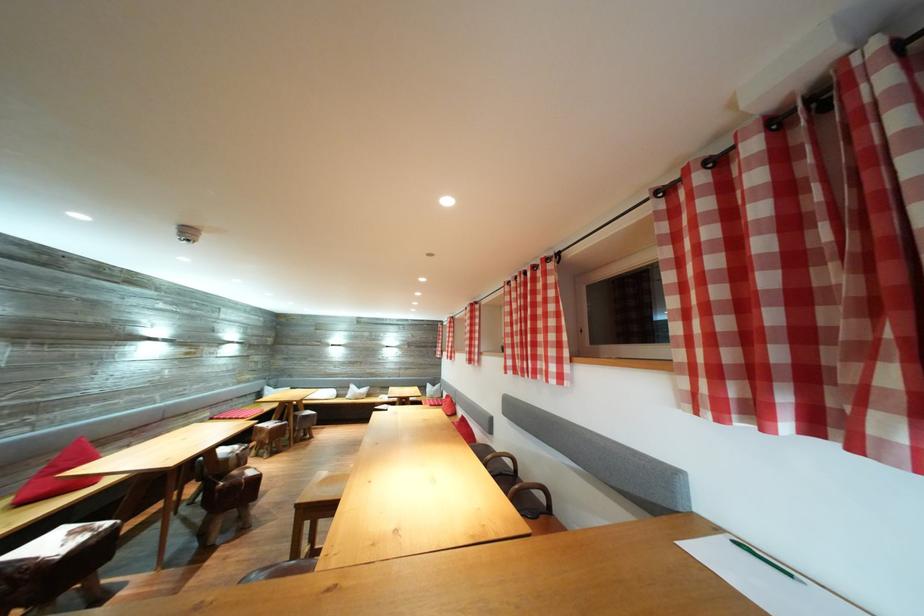
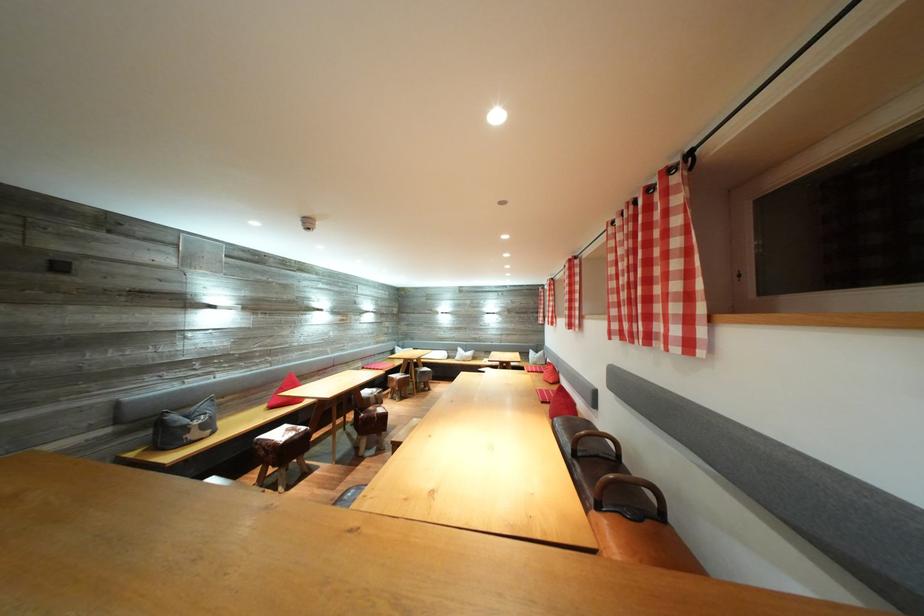
In the second image, find the point that corresponds to (x=549, y=523) in the first image.

(655, 529)